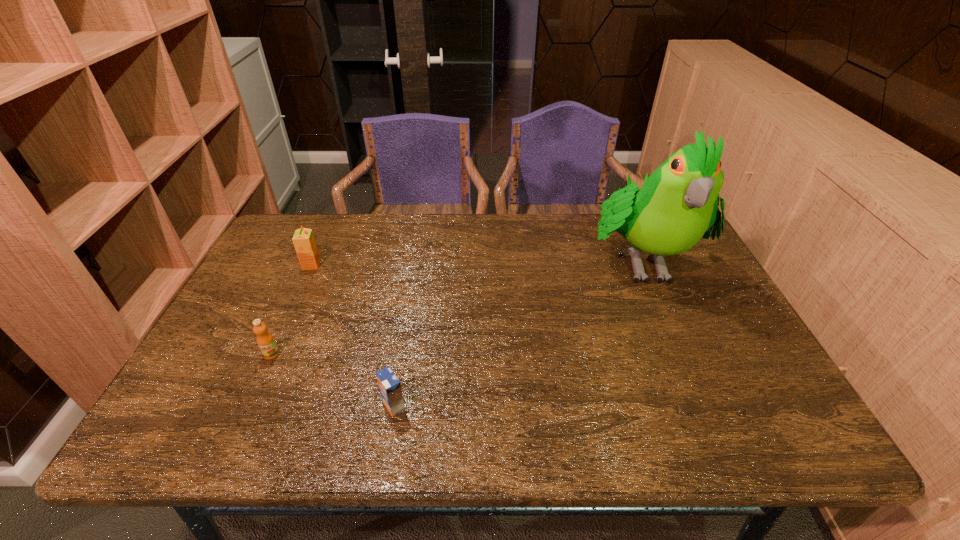
Image resolution: width=960 pixels, height=540 pixels. I want to click on object positioned at the far edge, so click(x=678, y=203).

At what (x,y) coordinates should I click in order to perform the action: click on object at the near edge. Please return your answer as a coordinate pair (x, y). This screenshot has width=960, height=540. Looking at the image, I should click on (389, 385).

Image resolution: width=960 pixels, height=540 pixels. What are the coordinates of `object that is at the right edge` in the screenshot? It's located at (678, 203).

Where is `object situated at the far right corner`? Image resolution: width=960 pixels, height=540 pixels. object situated at the far right corner is located at coordinates (678, 203).

You are a GUI agent. You are given a task and a screenshot of the screen. Output one action in this format:
    pyautogui.click(x=<x>, y=<y>)
    Task: Click on the free space at the far edge of the desktop
    This screenshot has width=960, height=540.
    Given the screenshot: What is the action you would take?
    pyautogui.click(x=439, y=245)

Locate an element on the screen. free space at the near edge is located at coordinates (283, 441).

Where is `free point at the left edge`? free point at the left edge is located at coordinates (256, 276).

In order to click on vacant space at the right edge in this screenshot , I will do `click(739, 399)`.

In the image, there is a desktop. Where is `vacant space at the near left corner`? vacant space at the near left corner is located at coordinates (165, 415).

Where is `free space between the parakeet and the nearest object`? free space between the parakeet and the nearest object is located at coordinates (517, 333).